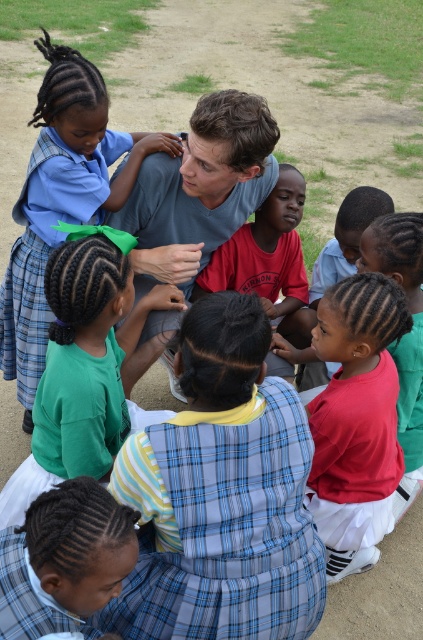
You are a delivery drone with a wingspan of 1 meter. You need to fly between the light blue cotton shirt at center and the plaid fabric skirt at lower left. Can you fit through the space between them?

The distance between the light blue cotton shirt at center and the plaid fabric skirt at lower left is 1.32 meters, so yes, the drone can fit through the space since its wingspan is 1 meter, which is narrower than the available space.

You are a photographer trying to capture a photo of the light blue cotton shirt at center and the plaid fabric skirt at lower left. Which object should you focus on first if you want to ensure both are in the frame without moving the camera?

The light blue cotton shirt at center is located above the plaid fabric skirt at lower left, so you should focus on the plaid fabric skirt at lower left first to ensure both are in the frame without moving the camera.